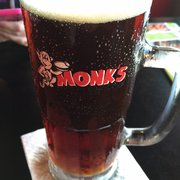
This screenshot has height=180, width=180. In order to click on tall beer mug in this screenshot , I will do point(117,97).